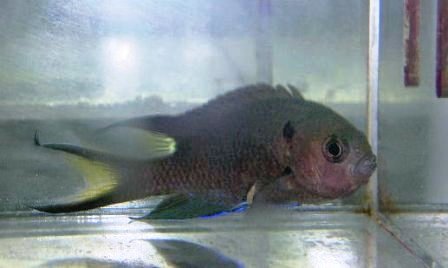
I want to click on scales, so click(x=227, y=159).